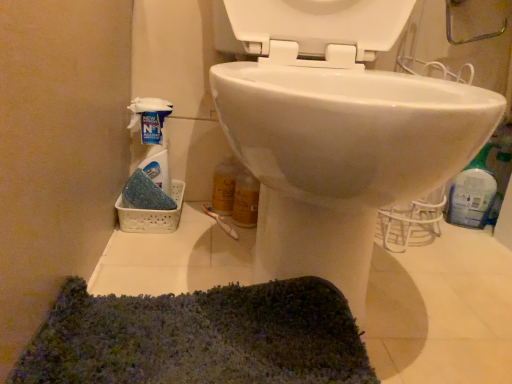
Question: Is white glossy toilet at center next to blue plastic bottle at right, which appears as the second cleaning product when viewed from the left, and touching it?

Choices:
 (A) no
 (B) yes

Answer: (A)

Question: From the image's perspective, is white glossy toilet at center located above blue plastic bottle at right, which appears as the second cleaning product when viewed from the left?

Choices:
 (A) yes
 (B) no

Answer: (A)

Question: Considering the relative positions of white glossy toilet at center and blue plastic bottle at right, which is counted as the 1th cleaning product, starting from the right, in the image provided, is white glossy toilet at center to the left of blue plastic bottle at right, which is counted as the 1th cleaning product, starting from the right, from the viewer's perspective?

Choices:
 (A) no
 (B) yes

Answer: (B)

Question: Is the position of white glossy toilet at center less distant than that of blue plastic bottle at right, which is counted as the 1th cleaning product, starting from the right?

Choices:
 (A) no
 (B) yes

Answer: (B)

Question: From the image's perspective, is white glossy toilet at center below blue plastic bottle at right, which appears as the second cleaning product when viewed from the left?

Choices:
 (A) yes
 (B) no

Answer: (B)

Question: Is blue plastic bottle at right, which appears as the second cleaning product when viewed from the left, a part of white glossy toilet at center?

Choices:
 (A) yes
 (B) no

Answer: (B)

Question: Does blue plastic bottle at right, which is counted as the 1th cleaning product, starting from the right, have a greater width compared to white glossy toilet at center?

Choices:
 (A) yes
 (B) no

Answer: (B)

Question: Is blue plastic bottle at right, which is counted as the 1th cleaning product, starting from the right, positioned before white glossy toilet at center?

Choices:
 (A) no
 (B) yes

Answer: (A)

Question: From a real-world perspective, is blue plastic bottle at right, which appears as the second cleaning product when viewed from the left, positioned under white glossy toilet at center based on gravity?

Choices:
 (A) yes
 (B) no

Answer: (A)

Question: Is blue plastic bottle at right, which is counted as the 1th cleaning product, starting from the right, thinner than white glossy toilet at center?

Choices:
 (A) no
 (B) yes

Answer: (B)

Question: Can you confirm if blue plastic bottle at right, which is counted as the 1th cleaning product, starting from the right, is smaller than white glossy toilet at center?

Choices:
 (A) no
 (B) yes

Answer: (B)

Question: Could you tell me if blue plastic bottle at right, which appears as the second cleaning product when viewed from the left, is facing white glossy toilet at center?

Choices:
 (A) no
 (B) yes

Answer: (B)

Question: Is white plastic spray bottle at left, the first cleaning product positioned from the left, to the left of white glossy toilet at center from the viewer's perspective?

Choices:
 (A) yes
 (B) no

Answer: (A)